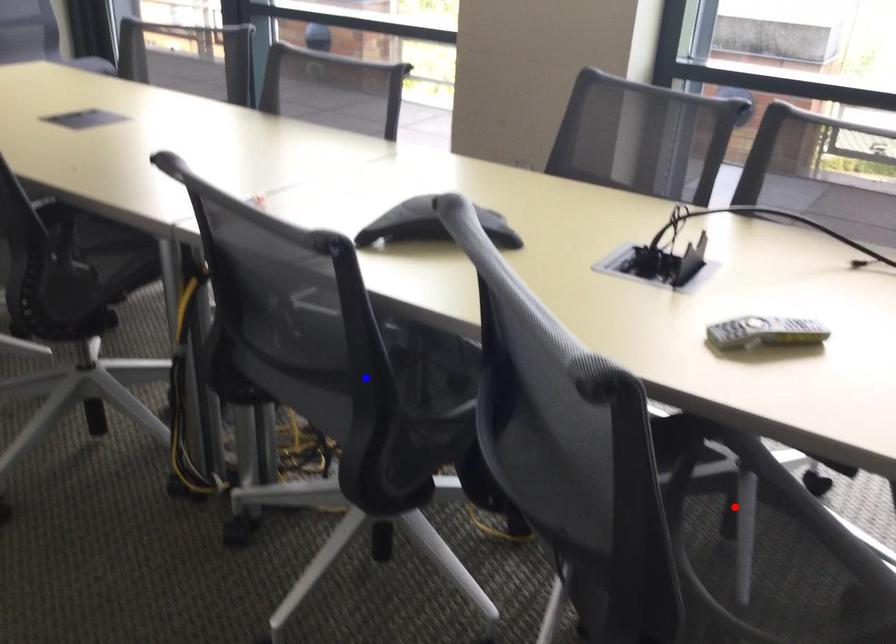
Question: In the image, two points are highlighted. Which point is nearer to the camera? Reply with the corresponding letter.

Choices:
 (A) blue point
 (B) red point

Answer: (B)